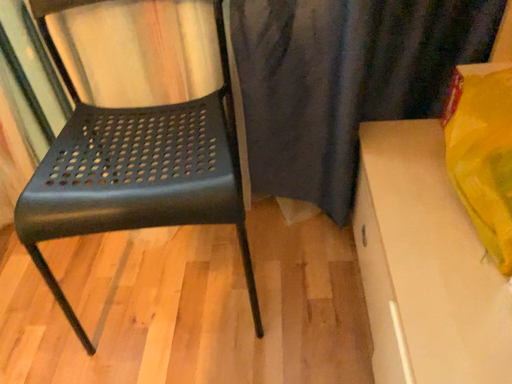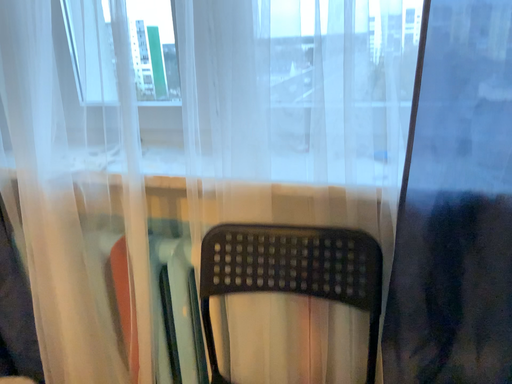
Question: How did the camera likely rotate when shooting the video?

Choices:
 (A) rotated left
 (B) rotated right

Answer: (A)